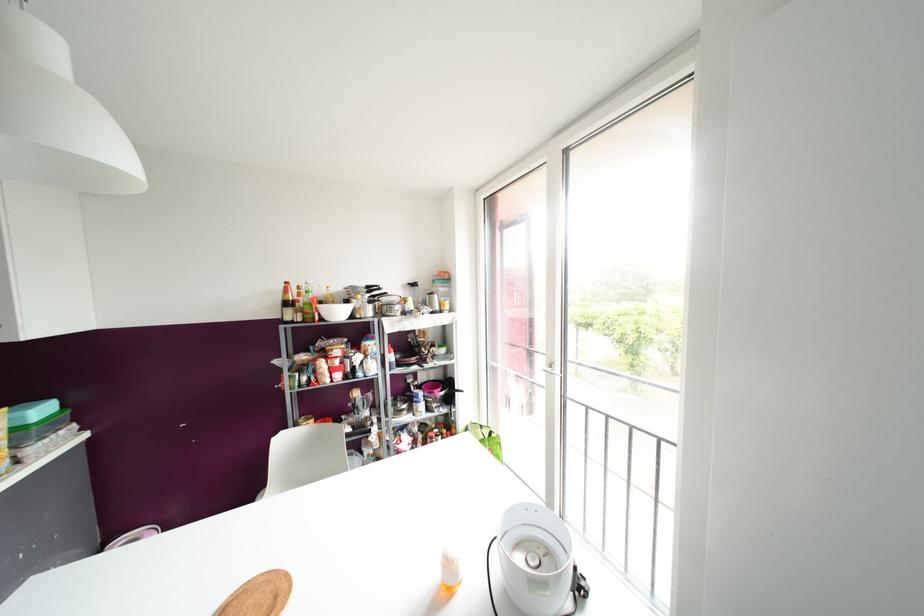
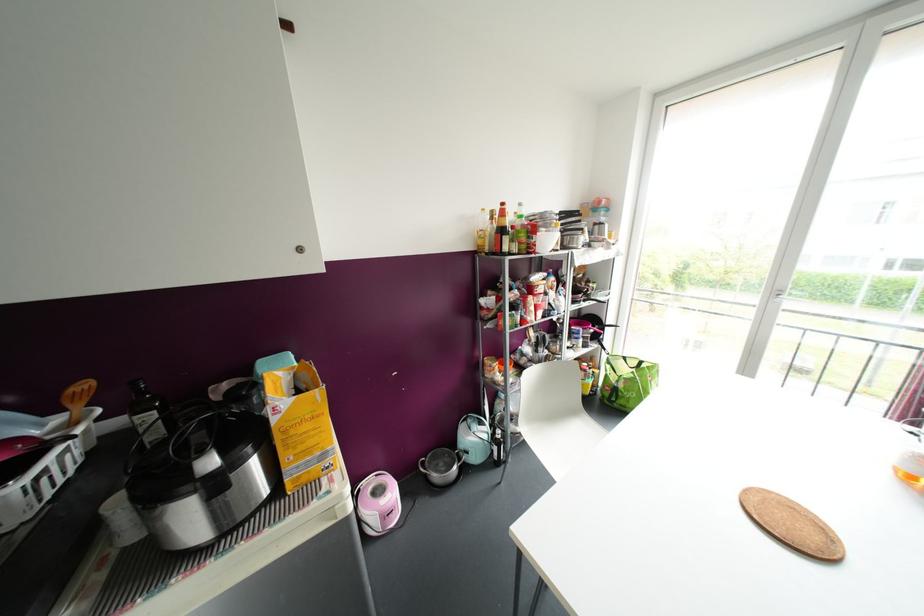
Question: The images are taken continuously from a first-person perspective. In which direction are you moving?

Choices:
 (A) Left
 (B) Right
 (C) Forward
 (D) Backward

Answer: (A)